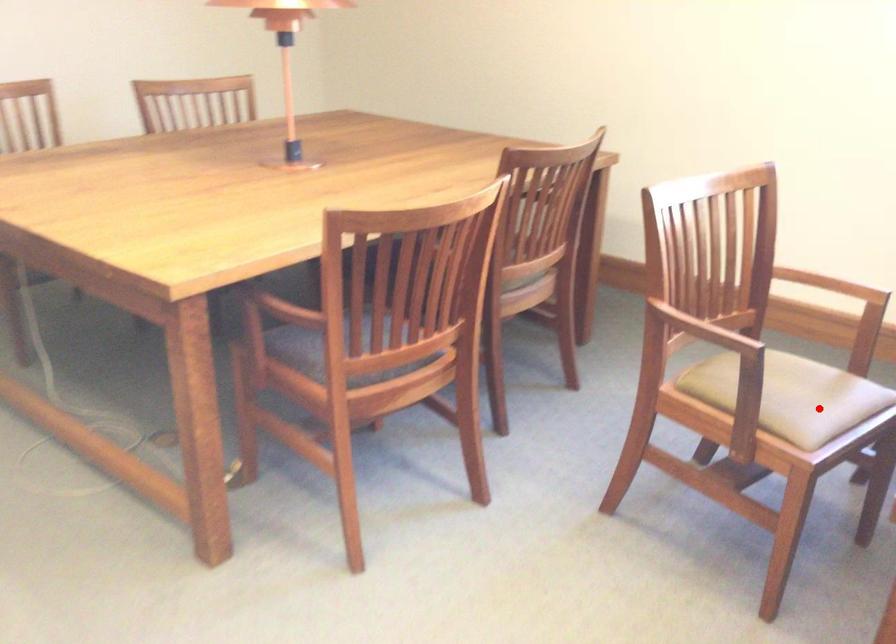
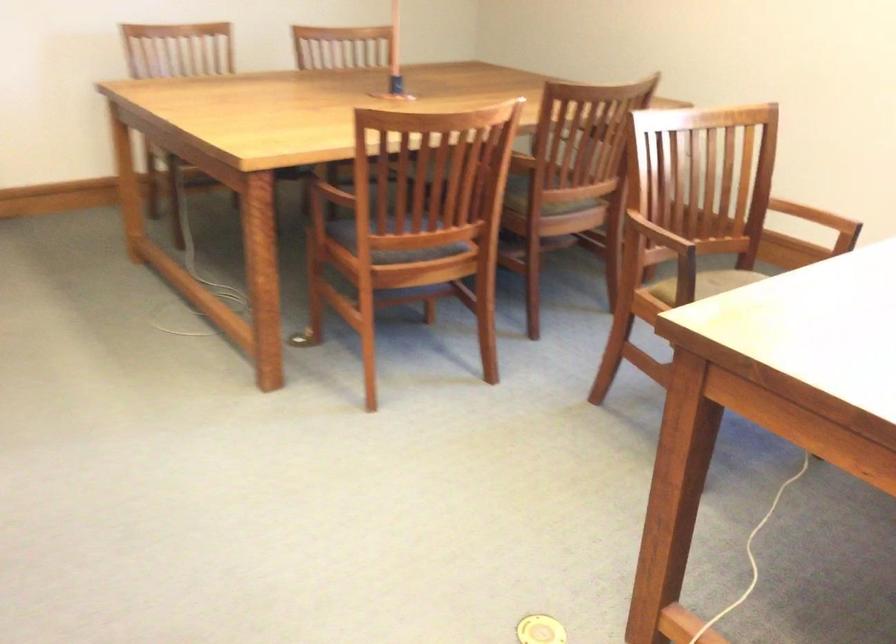
Question: I am providing you with two images of the same scene from different viewpoints. A red point is marked on the first image. At the location where the point appears in image 1, is it still visible in image 2?

Choices:
 (A) Yes
 (B) No

Answer: (B)